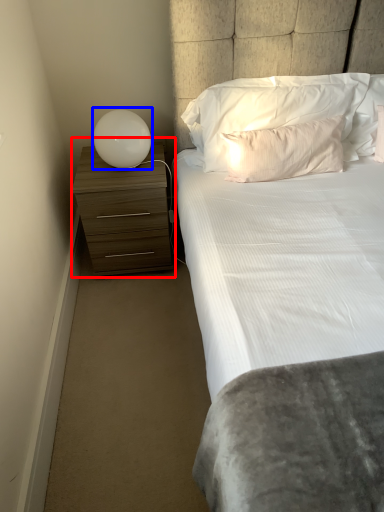
Question: Which object appears farthest to the camera in this image, chest of drawers (highlighted by a red box) or lamp (highlighted by a blue box)?

Choices:
 (A) chest of drawers
 (B) lamp

Answer: (A)